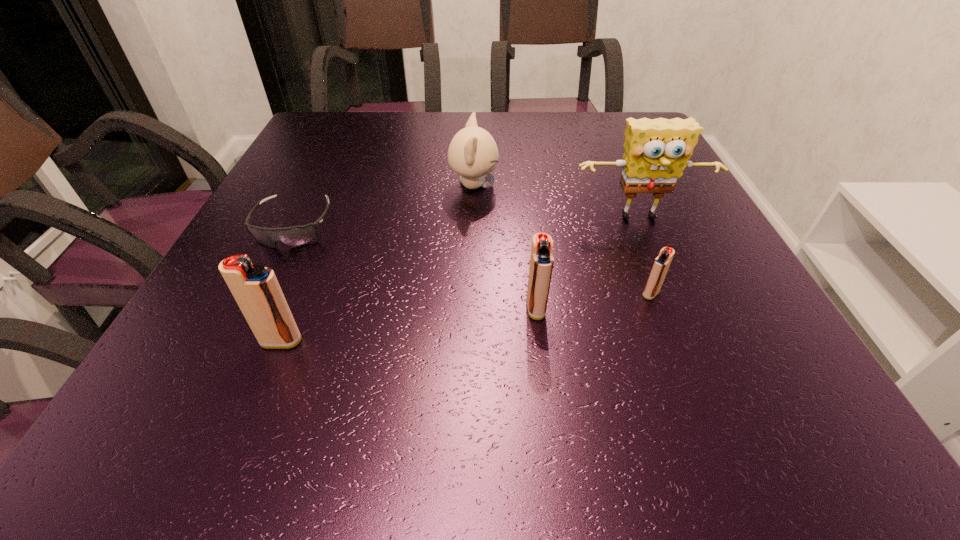
The height and width of the screenshot is (540, 960). I want to click on the nearest igniter, so click(255, 288).

I want to click on the leftmost igniter, so click(255, 288).

Where is `the fourth object from left to right`? The width and height of the screenshot is (960, 540). the fourth object from left to right is located at coordinates (541, 262).

Identify the location of the second tallest igniter. The width and height of the screenshot is (960, 540). (541, 262).

This screenshot has width=960, height=540. In order to click on the rightmost igniter in this screenshot , I will do `click(661, 264)`.

The height and width of the screenshot is (540, 960). In order to click on the fifth tallest object in this screenshot , I will do `click(661, 264)`.

Locate an element on the screen. The image size is (960, 540). kitten is located at coordinates (473, 154).

This screenshot has height=540, width=960. I want to click on the third object from left to right, so click(473, 154).

Find the location of a particular element. The height and width of the screenshot is (540, 960). sponge is located at coordinates (657, 151).

You are a GUI agent. You are given a task and a screenshot of the screen. Output one action in this format:
    pyautogui.click(x=<x>, y=<y>)
    Task: Click on the goggles
    The image size is (960, 540).
    Given the screenshot: What is the action you would take?
    pyautogui.click(x=295, y=236)